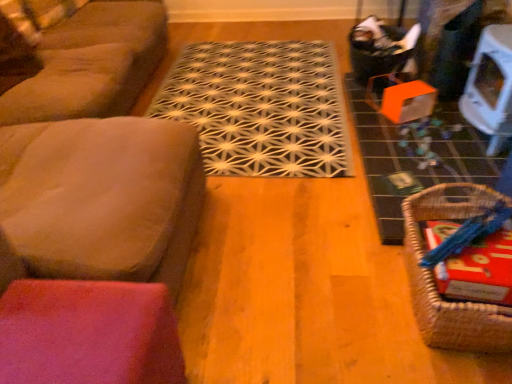
Question: Should I look upward or downward to see woven brown basket at lower right?

Choices:
 (A) up
 (B) down

Answer: (B)

Question: Could you tell me if woven brown basket at lower right is facing suede-like brown couch at left?

Choices:
 (A) no
 (B) yes

Answer: (A)

Question: Is woven brown basket at lower right completely or partially outside of suede-like brown couch at left?

Choices:
 (A) yes
 (B) no

Answer: (A)

Question: Does woven brown basket at lower right appear on the right side of suede-like brown couch at left?

Choices:
 (A) no
 (B) yes

Answer: (B)

Question: Is the depth of woven brown basket at lower right greater than that of suede-like brown couch at left?

Choices:
 (A) yes
 (B) no

Answer: (B)

Question: Is woven brown basket at lower right positioned with its back to suede-like brown couch at left?

Choices:
 (A) no
 (B) yes

Answer: (A)

Question: Could suede-like brown couch at left be considered to be inside woven brown basket at lower right?

Choices:
 (A) yes
 (B) no

Answer: (B)

Question: Is white glossy table at upper right positioned before suede-like brown couch at left?

Choices:
 (A) no
 (B) yes

Answer: (A)

Question: Is white glossy table at upper right touching suede-like brown couch at left?

Choices:
 (A) yes
 (B) no

Answer: (B)

Question: From the image's perspective, would you say white glossy table at upper right is positioned over suede-like brown couch at left?

Choices:
 (A) no
 (B) yes

Answer: (B)

Question: Is white glossy table at upper right taller than suede-like brown couch at left?

Choices:
 (A) no
 (B) yes

Answer: (A)

Question: From a real-world perspective, is white glossy table at upper right on suede-like brown couch at left?

Choices:
 (A) yes
 (B) no

Answer: (B)

Question: Considering the relative sizes of white glossy table at upper right and suede-like brown couch at left in the image provided, is white glossy table at upper right bigger than suede-like brown couch at left?

Choices:
 (A) no
 (B) yes

Answer: (A)

Question: Is suede-like brown couch at left looking in the opposite direction of suede-like brown couch at left?

Choices:
 (A) yes
 (B) no

Answer: (B)